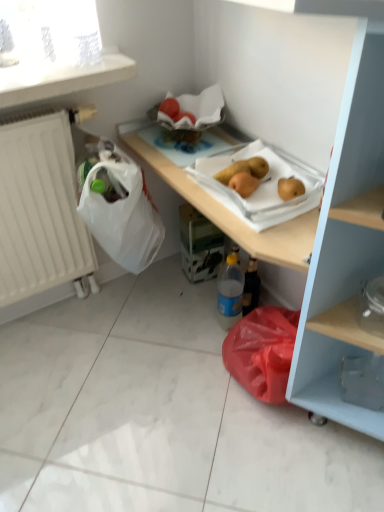
Identify the location of unoccupied area in front of yellow matte pear at center. (252, 207).